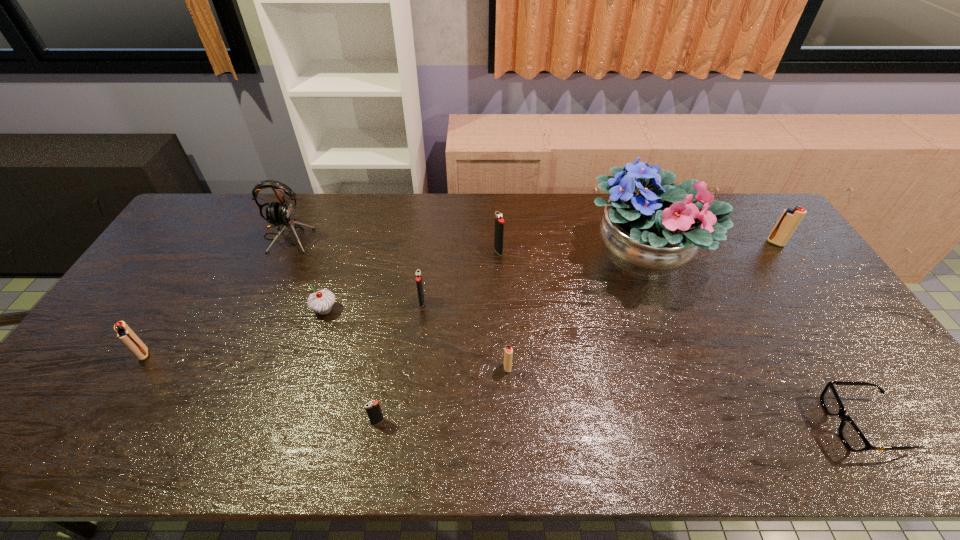
Identify the location of the seventh farthest object. (124, 333).

Where is `the leftmost object`? This screenshot has width=960, height=540. the leftmost object is located at coordinates (124, 333).

At what (x,y) coordinates should I click in order to perform the action: click on the eighth object from right to left. Please return your answer as a coordinate pair (x, y). Looking at the image, I should click on (321, 301).

Where is `gray cupcake`? This screenshot has width=960, height=540. gray cupcake is located at coordinates (321, 301).

I want to click on the smallest red igniter, so click(508, 351).

Find the location of `the second red igniter from left to right`. the second red igniter from left to right is located at coordinates (x=508, y=351).

Find the location of a particular element. the seventh object from right to left is located at coordinates (373, 410).

Find the location of a particular element. Image resolution: width=960 pixels, height=540 pixels. the second igniter from left to right is located at coordinates (373, 410).

You are a GUI agent. You are given a task and a screenshot of the screen. Output one action in this format:
    pyautogui.click(x=<x>, y=<y>)
    Task: Click on the black sunglasses
    The width and height of the screenshot is (960, 540).
    Given the screenshot: What is the action you would take?
    pyautogui.click(x=850, y=434)

Image resolution: width=960 pixels, height=540 pixels. Identify the location of sunglasses. (850, 434).